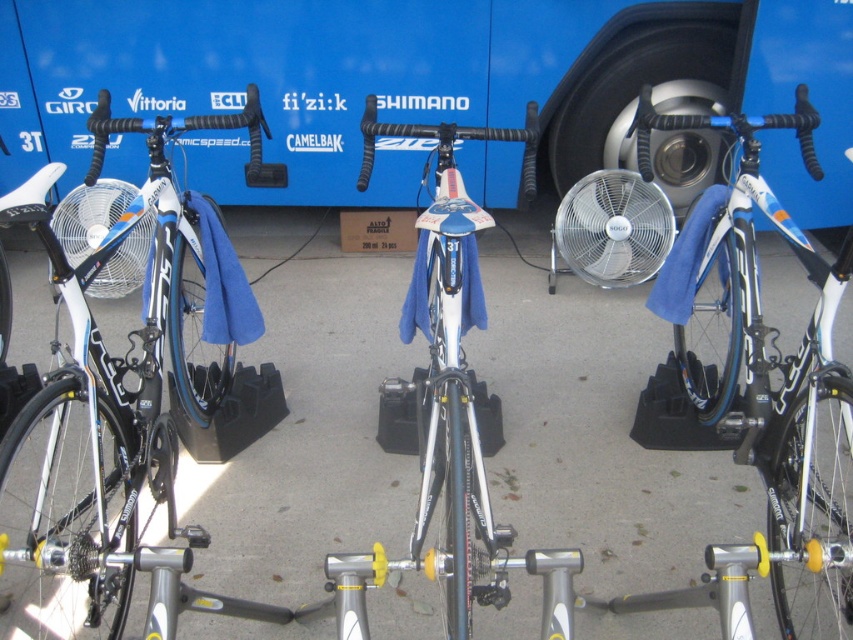
Between shiny white bike at center and white plastic fan at left, which one is positioned lower?

shiny white bike at center

Is shiny white bike at center in front of white plastic fan at left?

Yes, it is.

Between point (838, 586) and point (62, 212), which one is positioned in front?

Point (838, 586) is more forward.

Locate an element on the screen. This screenshot has height=640, width=853. shiny white bike at center is located at coordinates (766, 388).

Who is positioned more to the left, silver metallic fan at center or white plastic fan at left?

From the viewer's perspective, white plastic fan at left appears more on the left side.

Who is lower down, silver metallic fan at center or white plastic fan at left?

white plastic fan at left

Which is behind, point (614, 218) or point (97, 195)?

The point (97, 195) is more distant.

The image size is (853, 640). I want to click on silver metallic fan at center, so click(x=611, y=228).

Does point (444, 198) come farther from viewer compared to point (642, 218)?

That is False.

Measure the distance from shiny metallic bicycle at center to silver metallic fan at center.

1.32 meters

Does point (527, 141) come closer to viewer compared to point (656, 193)?

Yes, point (527, 141) is in front of point (656, 193).

The width and height of the screenshot is (853, 640). What are the coordinates of `shiny metallic bicycle at center` in the screenshot? It's located at (450, 380).